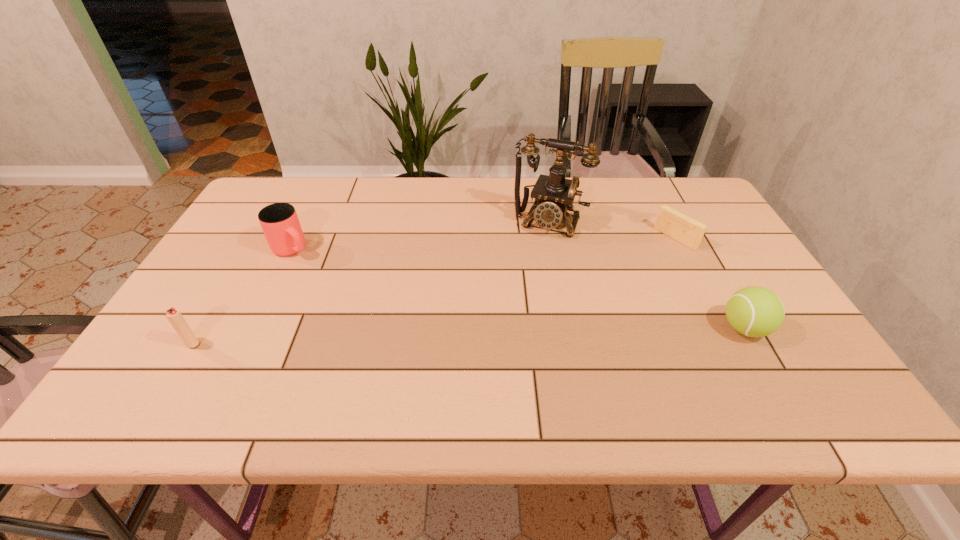
This screenshot has height=540, width=960. In order to click on the leftmost object in this screenshot , I will do `click(174, 316)`.

This screenshot has width=960, height=540. Identify the location of tennis ball. (752, 311).

This screenshot has width=960, height=540. I want to click on the fourth object from right to left, so click(279, 221).

Find the location of a particular element. The height and width of the screenshot is (540, 960). the tallest object is located at coordinates (554, 195).

Find the location of `the third object from left to right`. the third object from left to right is located at coordinates (554, 195).

At what (x,y) coordinates should I click in order to perform the action: click on the shortest object. Please return your answer as a coordinate pair (x, y). Looking at the image, I should click on (671, 222).

This screenshot has height=540, width=960. In order to click on blank space located on the back of the leftmost object in this screenshot , I will do `click(220, 296)`.

The image size is (960, 540). What are the coordinates of `vacant space located 0.310m on the back of the tennis ball` in the screenshot? It's located at (689, 233).

Locate an element on the screen. The height and width of the screenshot is (540, 960). free space located on the handle side of the fourth object from right to left is located at coordinates (399, 333).

Identify the location of free space located on the handle side of the fourth object from right to left. This screenshot has height=540, width=960. (333, 281).